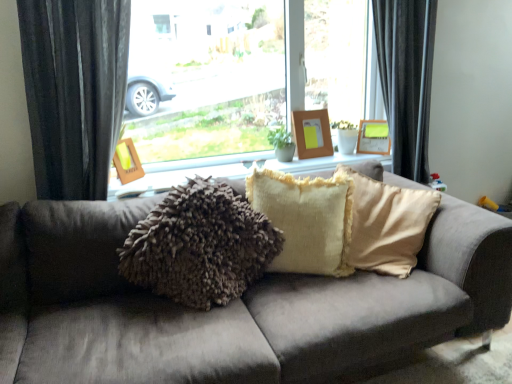
Question: Is wooden frame at center, positioned as the 2th picture frame in front-to-back order, in front of or behind velvet brown couch at center in the image?

Choices:
 (A) behind
 (B) front

Answer: (A)

Question: In the image, is wooden frame at center, which is the 2th picture frame in back-to-front order, on the left side or the right side of velvet brown couch at center?

Choices:
 (A) left
 (B) right

Answer: (B)

Question: Based on their relative distances, which object is nearer to the velvet brown couch at center?

Choices:
 (A) woodenwoodenpicture frame at left, the first picture frame positioned from the front
 (B) fuzzy beige pillow at center
 (C) wooden picture frame at upper center, positioned as the first picture frame in right-to-left order
 (D) wooden frame at center, the second picture frame positioned from the right
 (E) velvet dark gray curtain at left

Answer: (B)

Question: Which of these objects is positioned farthest from the fuzzy fabric pillows at center?

Choices:
 (A) velvet dark gray curtain at left
 (B) transparent glass window at center
 (C) wooden frame at center, positioned as the 2th picture frame in front-to-back order
 (D) fuzzy beige pillow at center
 (E) woodenwoodenpicture frame at left, the third picture frame from the right

Answer: (B)